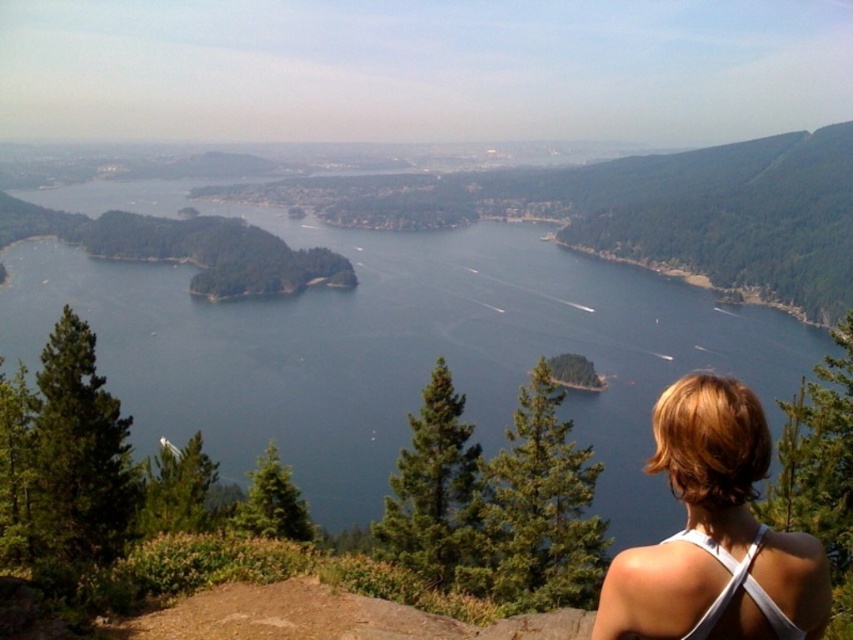
You are a photographer trying to capture the blue water at center and the white fabric at center in your shot. Which object will occupy more space in your photo?

The blue water at center is bigger than the white fabric at center, so it will occupy more space in the photo.